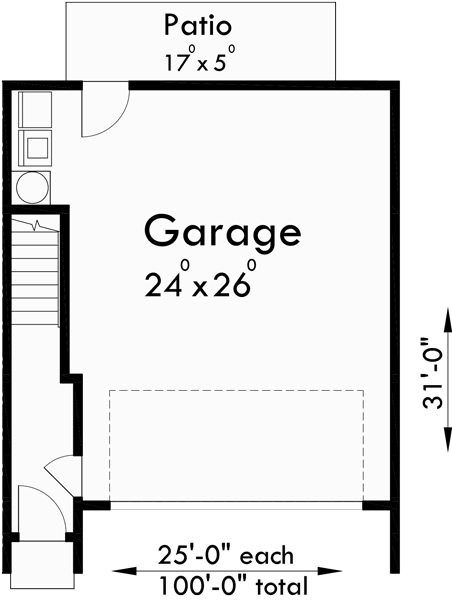
The image size is (452, 600). Identify the location of doors. click(74, 476), click(45, 534).